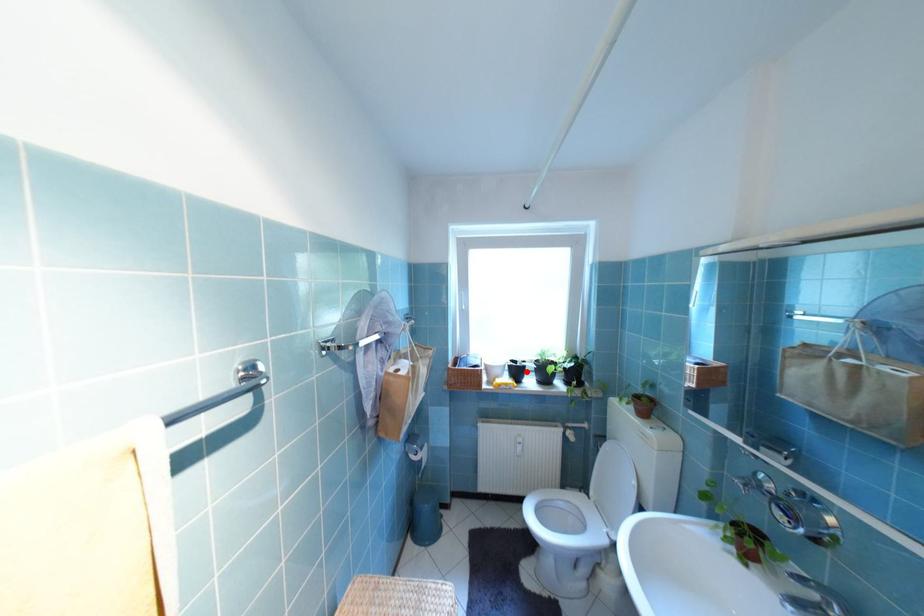
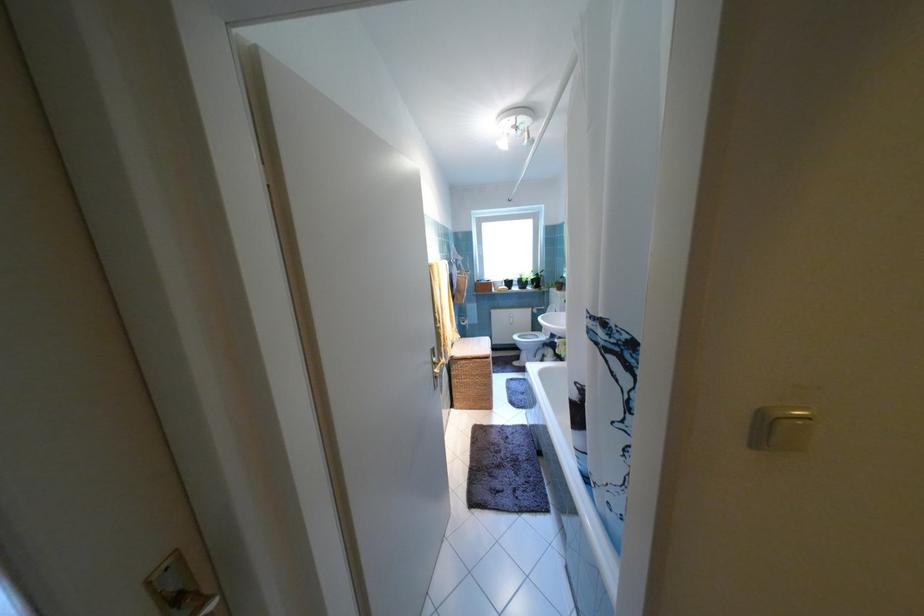
The point at the highlighted location is marked in the first image. Where is the corresponding point in the second image?

(517, 284)